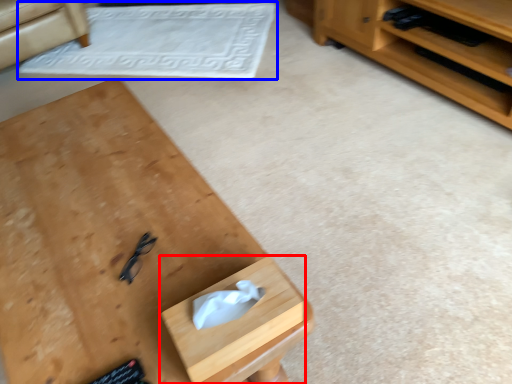
Question: Among these objects, which one is nearest to the camera, drawer (highlighted by a red box) or mat (highlighted by a blue box)?

Choices:
 (A) drawer
 (B) mat

Answer: (A)